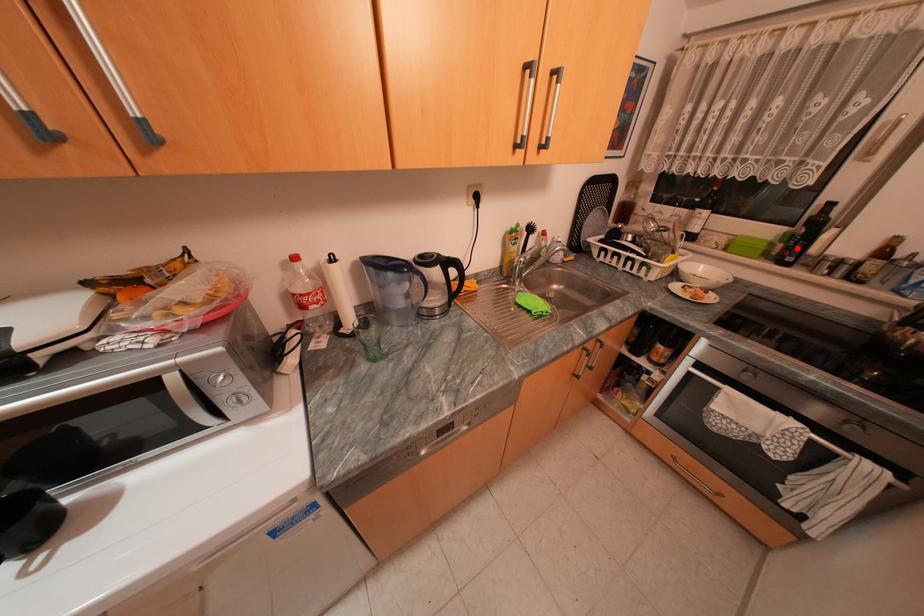
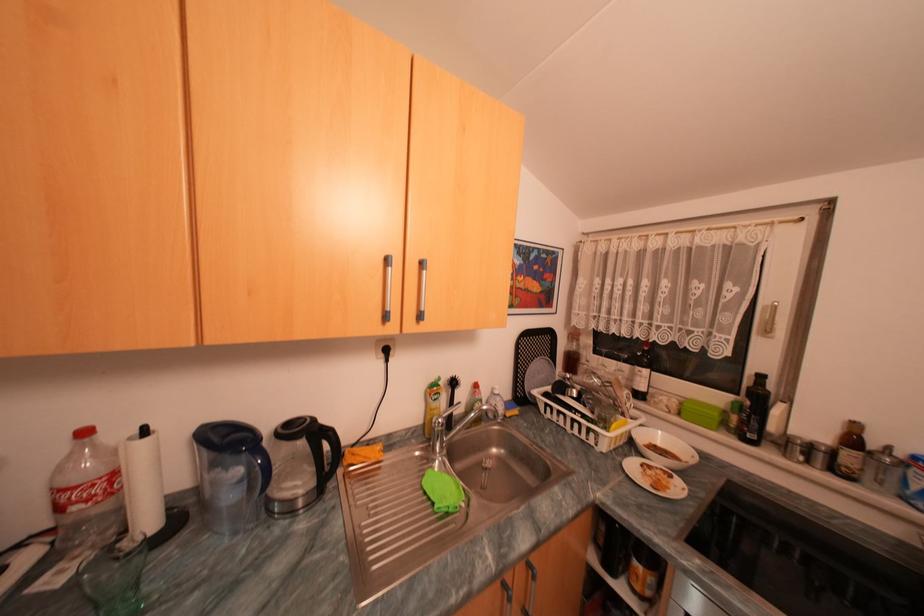
The point at the highlighted location is marked in the first image. Where is the corresponding point in the second image?

(752, 422)